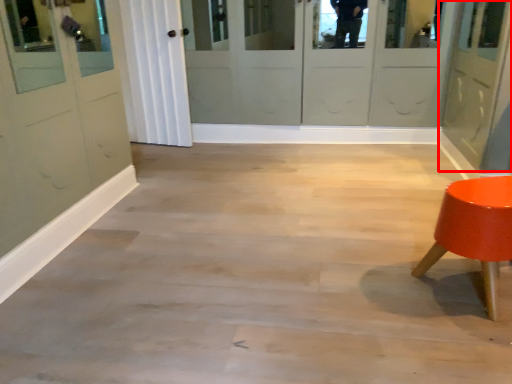
Question: From the image, what is the correct spatial relationship of door (annotated by the red box) in relation to furniture?

Choices:
 (A) right
 (B) left

Answer: (A)